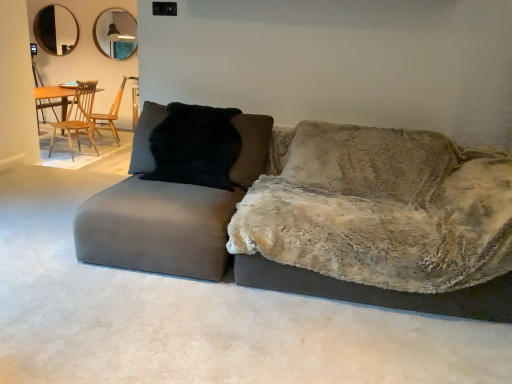
Identify the location of matte gray swivel chair at left. (169, 209).

This screenshot has width=512, height=384. What do you see at coordinates (169, 209) in the screenshot?
I see `matte gray swivel chair at left` at bounding box center [169, 209].

How much space does matte silver mirror at upper center, arranged as the 2th mirror when viewed from the left, occupy vertically?

It is 33.95 inches.

Where is `wooden chair at left, marked as the second chair in a back-to-front arrangement`? Image resolution: width=512 pixels, height=384 pixels. wooden chair at left, marked as the second chair in a back-to-front arrangement is located at coordinates (78, 116).

At what (x,y) coordinates should I click in order to perform the action: click on wooden chair at center, the 2th chair when ordered from front to back. Please return your answer as a coordinate pair (x, y). The image size is (512, 384). Looking at the image, I should click on (108, 116).

Find the location of a particular element. This screenshot has width=512, height=384. black glass mirror at upper left, marked as the 1th mirror in a left-to-right arrangement is located at coordinates (56, 30).

This screenshot has width=512, height=384. In order to click on velvet gray couch at center in this screenshot , I will do `click(153, 229)`.

In the scene shown: Considering the sizes of objects black glass mirror at upper left, marked as the 1th mirror in a left-to-right arrangement, and matte silver mirror at upper center, arranged as the 2th mirror when viewed from the left, in the image provided, who is thinner, black glass mirror at upper left, marked as the 1th mirror in a left-to-right arrangement, or matte silver mirror at upper center, arranged as the 2th mirror when viewed from the left,?

Thinner between the two is black glass mirror at upper left, marked as the 1th mirror in a left-to-right arrangement.

Locate an element on the screen. This screenshot has height=384, width=512. mirror on the left of matte silver mirror at upper center, the 1th mirror in the right-to-left sequence is located at coordinates (56, 30).

Consider the image. Is black glass mirror at upper left, marked as the 1th mirror in a left-to-right arrangement, located outside matte silver mirror at upper center, arranged as the 2th mirror when viewed from the left?

Yes, black glass mirror at upper left, marked as the 1th mirror in a left-to-right arrangement, is located beyond the bounds of matte silver mirror at upper center, arranged as the 2th mirror when viewed from the left.

Which is farther, (62, 47) or (133, 53)?

The point (133, 53) is farther.

Considering the sizes of objects matte silver mirror at upper center, the 1th mirror in the right-to-left sequence, and black glass mirror at upper left, marked as the 1th mirror in a left-to-right arrangement, in the image provided, who is smaller, matte silver mirror at upper center, the 1th mirror in the right-to-left sequence, or black glass mirror at upper left, marked as the 1th mirror in a left-to-right arrangement,?

With smaller size is black glass mirror at upper left, marked as the 1th mirror in a left-to-right arrangement.

From the image's perspective, is matte silver mirror at upper center, the 1th mirror in the right-to-left sequence, under black glass mirror at upper left, the 2th mirror when ordered from right to left?

Yes.

From the picture: Is matte silver mirror at upper center, the 1th mirror in the right-to-left sequence, facing towards black glass mirror at upper left, the 2th mirror when ordered from right to left?

No, matte silver mirror at upper center, the 1th mirror in the right-to-left sequence, does not turn towards black glass mirror at upper left, the 2th mirror when ordered from right to left.

Is matte silver mirror at upper center, the 1th mirror in the right-to-left sequence, not near black glass mirror at upper left, the 2th mirror when ordered from right to left?

No, matte silver mirror at upper center, the 1th mirror in the right-to-left sequence, is not far away from black glass mirror at upper left, the 2th mirror when ordered from right to left.

Between matte silver mirror at upper center, arranged as the 2th mirror when viewed from the left, and black fur pillow at center, which one has less height?

black fur pillow at center is shorter.

Is matte silver mirror at upper center, arranged as the 2th mirror when viewed from the left, facing away from black fur pillow at center?

No.

Does matte silver mirror at upper center, arranged as the 2th mirror when viewed from the left, have a lesser width compared to black fur pillow at center?

Indeed, matte silver mirror at upper center, arranged as the 2th mirror when viewed from the left, has a lesser width compared to black fur pillow at center.

Relative to black fur pillow at center, is matte silver mirror at upper center, arranged as the 2th mirror when viewed from the left, in front or behind?

matte silver mirror at upper center, arranged as the 2th mirror when viewed from the left, is positioned farther from the viewer than black fur pillow at center.

Looking at this image, which is correct: wooden chair at left, arranged as the first chair when viewed from the front, is inside black fur pillow at center, or outside of it?

wooden chair at left, arranged as the first chair when viewed from the front, is not enclosed by black fur pillow at center.

Looking at this image, from the image's perspective, which one is positioned higher, wooden chair at left, marked as the second chair in a back-to-front arrangement, or black fur pillow at center?

From the image's view, wooden chair at left, marked as the second chair in a back-to-front arrangement, is above.

From a real-world perspective, is wooden chair at left, arranged as the first chair when viewed from the front, positioned under black fur pillow at center based on gravity?

Yes, from a real-world perspective, wooden chair at left, arranged as the first chair when viewed from the front, is under black fur pillow at center.

Looking at their sizes, would you say wooden chair at left, arranged as the first chair when viewed from the front, is wider or thinner than black fur pillow at center?

wooden chair at left, arranged as the first chair when viewed from the front, is wider than black fur pillow at center.

From the picture: Could you tell me if wooden chair at center, the first chair from the back, is turned towards matte silver mirror at upper center, arranged as the 2th mirror when viewed from the left?

No, wooden chair at center, the first chair from the back, is not oriented towards matte silver mirror at upper center, arranged as the 2th mirror when viewed from the left.

Between wooden chair at center, the first chair from the back, and matte silver mirror at upper center, arranged as the 2th mirror when viewed from the left, which one has larger width?

Wider between the two is wooden chair at center, the first chair from the back.

Which point is more forward, (x=116, y=108) or (x=109, y=52)?

The point (x=109, y=52) is closer.

Looking at this image, from the image's perspective, which one is positioned lower, wooden chair at center, the 2th chair when ordered from front to back, or matte silver mirror at upper center, the 1th mirror in the right-to-left sequence?

wooden chair at center, the 2th chair when ordered from front to back, from the image's perspective.

Which of these two, black glass mirror at upper left, the 2th mirror when ordered from right to left, or wooden chair at left, arranged as the first chair when viewed from the front, is wider?

With larger width is wooden chair at left, arranged as the first chair when viewed from the front.

Between black glass mirror at upper left, marked as the 1th mirror in a left-to-right arrangement, and wooden chair at left, marked as the second chair in a back-to-front arrangement, which one appears on the right side from the viewer's perspective?

Positioned to the right is wooden chair at left, marked as the second chair in a back-to-front arrangement.

Is point (60, 23) positioned in front of point (76, 106)?

Yes, point (60, 23) is in front of point (76, 106).

Which object is more forward, black glass mirror at upper left, the 2th mirror when ordered from right to left, or wooden chair at left, marked as the second chair in a back-to-front arrangement?

wooden chair at left, marked as the second chair in a back-to-front arrangement.

Is matte silver mirror at upper center, arranged as the 2th mirror when viewed from the left, inside black fur pillow at center?

Actually, matte silver mirror at upper center, arranged as the 2th mirror when viewed from the left, is outside black fur pillow at center.

How many degrees apart are the facing directions of black fur pillow at center and matte silver mirror at upper center, arranged as the 2th mirror when viewed from the left?

1.31 degrees separate the facing orientations of black fur pillow at center and matte silver mirror at upper center, arranged as the 2th mirror when viewed from the left.

Is black fur pillow at center positioned with its back to matte silver mirror at upper center, the 1th mirror in the right-to-left sequence?

No, matte silver mirror at upper center, the 1th mirror in the right-to-left sequence, is not at the back of black fur pillow at center.

Between black fur pillow at center and matte silver mirror at upper center, the 1th mirror in the right-to-left sequence, which one has smaller width?

With smaller width is matte silver mirror at upper center, the 1th mirror in the right-to-left sequence.

I want to click on mirror that appears on the right of black glass mirror at upper left, marked as the 1th mirror in a left-to-right arrangement, so click(115, 33).

Identify the location of mirror behind the matte silver mirror at upper center, the 1th mirror in the right-to-left sequence. (56, 30).

Considering their positions, is velvet gray couch at center positioned further to matte gray swivel chair at left than wooden chair at left, marked as the second chair in a back-to-front arrangement?

wooden chair at left, marked as the second chair in a back-to-front arrangement.

Looking at the image, which one is located further to matte gray swivel chair at left, wooden chair at center, the first chair from the back, or black glass mirror at upper left, marked as the 1th mirror in a left-to-right arrangement?

black glass mirror at upper left, marked as the 1th mirror in a left-to-right arrangement.

Estimate the real-world distances between objects in this image. Which object is closer to wooden chair at center, the 2th chair when ordered from front to back, matte gray swivel chair at left or wooden chair at left, arranged as the first chair when viewed from the front?

wooden chair at left, arranged as the first chair when viewed from the front, is positioned closer to the anchor wooden chair at center, the 2th chair when ordered from front to back.

Based on their spatial positions, is black glass mirror at upper left, marked as the 1th mirror in a left-to-right arrangement, or matte gray swivel chair at left further from wooden chair at left, arranged as the first chair when viewed from the front?

Based on the image, matte gray swivel chair at left appears to be further to wooden chair at left, arranged as the first chair when viewed from the front.

From the picture: Looking at the image, which one is located further to matte gray swivel chair at left, velvet gray couch at center or wooden chair at center, the first chair from the back?

The object further to matte gray swivel chair at left is wooden chair at center, the first chair from the back.

Which object lies further to the anchor point velvet gray couch at center, matte gray swivel chair at left or wooden chair at left, arranged as the first chair when viewed from the front?

wooden chair at left, arranged as the first chair when viewed from the front, is positioned further to the anchor velvet gray couch at center.

Estimate the real-world distances between objects in this image. Which object is closer to wooden chair at center, the first chair from the back, matte silver mirror at upper center, the 1th mirror in the right-to-left sequence, or matte gray swivel chair at left?

The object closer to wooden chair at center, the first chair from the back, is matte silver mirror at upper center, the 1th mirror in the right-to-left sequence.

When comparing their distances from matte silver mirror at upper center, arranged as the 2th mirror when viewed from the left, does wooden chair at center, the first chair from the back, or black fur pillow at center seem closer?

Based on the image, wooden chair at center, the first chair from the back, appears to be nearer to matte silver mirror at upper center, arranged as the 2th mirror when viewed from the left.

Find the location of a particular element. chair positioned between matte gray swivel chair at left and wooden chair at center, the 2th chair when ordered from front to back, from near to far is located at coordinates (78, 116).

You are a GUI agent. You are given a task and a screenshot of the screen. Output one action in this format:
    pyautogui.click(x=<x>, y=<y>)
    Task: Click on the mirror located between velvet gray couch at center and black glass mirror at upper left, marked as the 1th mirror in a left-to-right arrangement, in the depth direction
    Image resolution: width=512 pixels, height=384 pixels.
    Given the screenshot: What is the action you would take?
    pyautogui.click(x=115, y=33)

Where is `chair located between wooden chair at left, arranged as the first chair when viewed from the front, and black glass mirror at upper left, the 2th mirror when ordered from right to left, in the depth direction`? chair located between wooden chair at left, arranged as the first chair when viewed from the front, and black glass mirror at upper left, the 2th mirror when ordered from right to left, in the depth direction is located at coordinates (108, 116).

You are a GUI agent. You are given a task and a screenshot of the screen. Output one action in this format:
    pyautogui.click(x=<x>, y=<y>)
    Task: Click on the mirror between black glass mirror at upper left, the 2th mirror when ordered from right to left, and wooden chair at center, the 2th chair when ordered from front to back, vertically
    Image resolution: width=512 pixels, height=384 pixels.
    Given the screenshot: What is the action you would take?
    pyautogui.click(x=115, y=33)